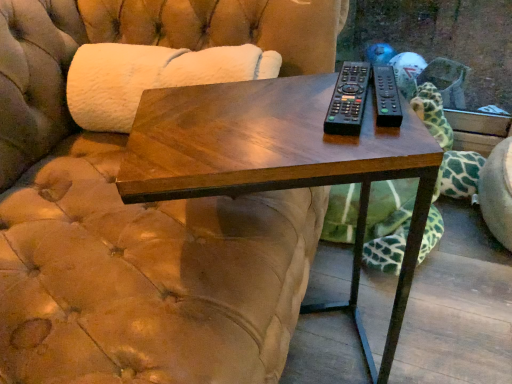
Find the location of a particular element. The width and height of the screenshot is (512, 384). vacant region to the left of black plastic remote at center, positioned as the 1th remote in right-to-left order is located at coordinates (274, 115).